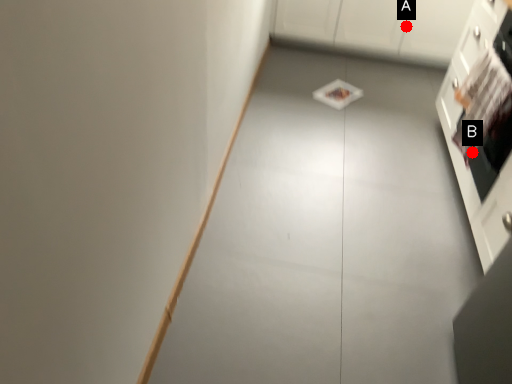
Question: Two points are circled on the image, labeled by A and B beside each circle. Which point is further to the camera?

Choices:
 (A) A is further
 (B) B is further

Answer: (A)